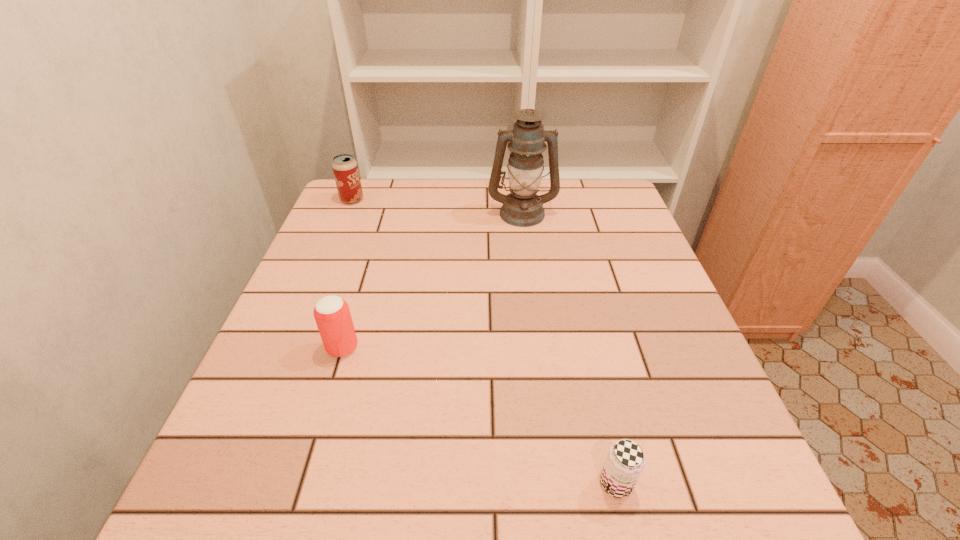
This screenshot has width=960, height=540. Find the location of `blank region between the second nearest beer can and the oil lamp`. blank region between the second nearest beer can and the oil lamp is located at coordinates (432, 280).

Locate an element on the screen. free spot between the tallest object and the second beer can from right to left is located at coordinates (432, 280).

Locate an element on the screen. Image resolution: width=960 pixels, height=540 pixels. the second closest object relative to the oil lamp is located at coordinates (332, 315).

Where is `object identified as the third closest to the second beer can from left to right`? The width and height of the screenshot is (960, 540). object identified as the third closest to the second beer can from left to right is located at coordinates (345, 169).

You are a GUI agent. You are given a task and a screenshot of the screen. Output one action in this format:
    pyautogui.click(x=<x>, y=<y>)
    Task: Click on the beer can that can be found as the closest to the farthest beer can
    The width and height of the screenshot is (960, 540).
    Given the screenshot: What is the action you would take?
    pyautogui.click(x=332, y=315)

Image resolution: width=960 pixels, height=540 pixels. In order to click on beer can that is the second closest to the shortest object in this screenshot , I will do `click(345, 169)`.

Find the location of a particular element. free space that satisfies the following two spatial constraints: 1. on the front side of the nearest beer can; 2. on the left side of the leftmost beer can is located at coordinates (234, 483).

At what (x,y) coordinates should I click in order to perform the action: click on free point that satisfies the following two spatial constraints: 1. on the front side of the second farthest beer can; 2. on the right side of the shortest beer can. Please return your answer as a coordinate pair (x, y). Looking at the image, I should click on (301, 483).

Locate an element on the screen. vacant region that satisfies the following two spatial constraints: 1. on the front side of the farthest beer can; 2. on the left side of the tallest object is located at coordinates (347, 213).